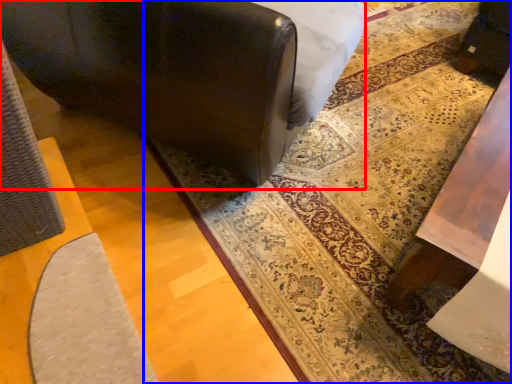
Question: Which of the following is the farthest to the observer, furniture (highlighted by a red box) or mat (highlighted by a blue box)?

Choices:
 (A) furniture
 (B) mat

Answer: (B)